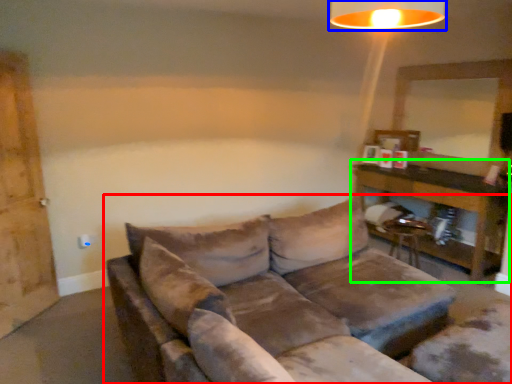
Question: Which object is the closest to the studio couch (highlighted by a red box)? Choose among these: lamp (highlighted by a blue box) or table (highlighted by a green box).

Choices:
 (A) lamp
 (B) table

Answer: (A)